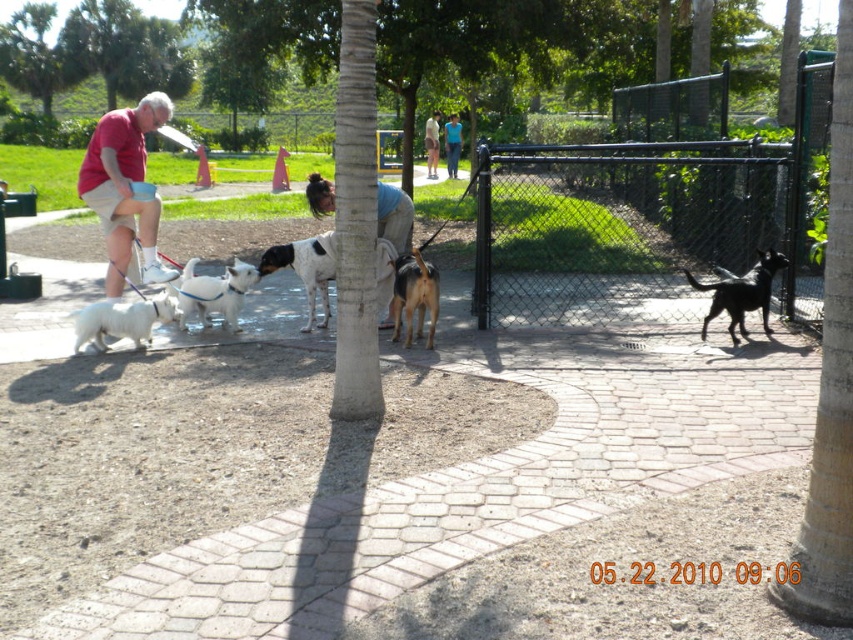
This screenshot has height=640, width=853. Describe the element at coordinates (120, 321) in the screenshot. I see `white matte dog at lower left` at that location.

Does point (136, 337) come behind point (781, 256)?

That is False.

Who is more forward, (108,301) or (711,289)?

Point (108,301) is more forward.

Locate an element on the screen. white matte dog at lower left is located at coordinates (120, 321).

Who is shorter, matte red shirt at left or blue denim jacket at center?

blue denim jacket at center is shorter.

The height and width of the screenshot is (640, 853). What do you see at coordinates (125, 188) in the screenshot?
I see `matte red shirt at left` at bounding box center [125, 188].

The width and height of the screenshot is (853, 640). I want to click on matte red shirt at left, so point(125,188).

Between white matte dog at center and light blue denim shorts at center, which one appears on the right side from the viewer's perspective?

From the viewer's perspective, light blue denim shorts at center appears more on the right side.

Is white matte dog at center positioned behind light blue denim shorts at center?

That is False.

Measure the distance between point (234, 262) and camera.

The distance of point (234, 262) from camera is 8.58 meters.

Identify the location of white matte dog at center. (213, 292).